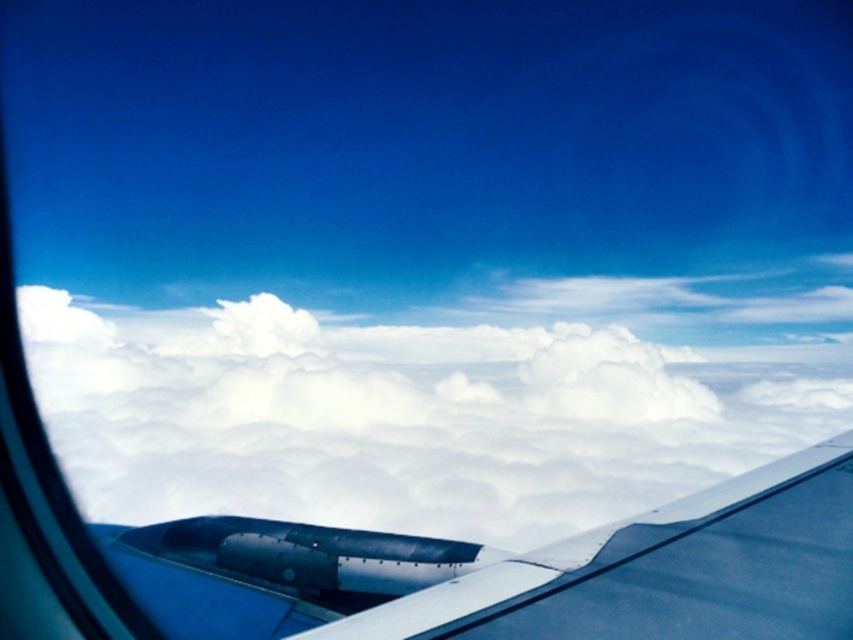
Question: Can you confirm if white fluffy cloud at center is positioned to the left of metallic blue wing at lower right?

Choices:
 (A) no
 (B) yes

Answer: (A)

Question: Which of the following is the closest to the observer?

Choices:
 (A) metallic blue wing at lower right
 (B) white fluffy cloud at center

Answer: (A)

Question: Is white fluffy cloud at center behind metallic blue wing at lower right?

Choices:
 (A) yes
 (B) no

Answer: (A)

Question: Which object appears farthest from the camera in this image?

Choices:
 (A) white fluffy cloud at center
 (B) metallic blue wing at lower right

Answer: (A)

Question: From the image, what is the correct spatial relationship of white fluffy cloud at center in relation to metallic blue wing at lower right?

Choices:
 (A) left
 (B) right

Answer: (B)